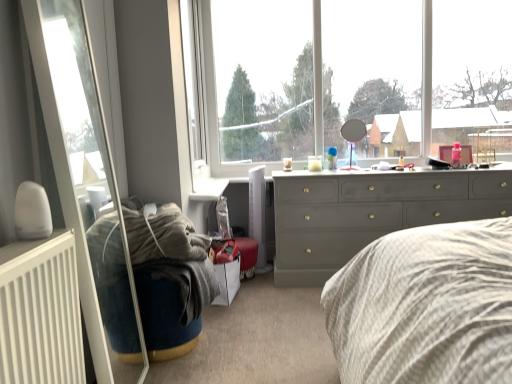
In order to face transparent glass mirror at upper center, should I rotate leftwards or rightwards?

You should look right and rotate roughly 14.026 degrees.

The width and height of the screenshot is (512, 384). What do you see at coordinates (41, 312) in the screenshot?
I see `white matte radiator at lower left` at bounding box center [41, 312].

Where is `transparent glass mirror at upper center`? transparent glass mirror at upper center is located at coordinates (338, 75).

From the image's perspective, is velvet blue bean bag at lower left below transparent glass door at left?

Yes, from the image's perspective, velvet blue bean bag at lower left is beneath transparent glass door at left.

Considering the sizes of objects velvet blue bean bag at lower left and transparent glass door at left in the image provided, who is smaller, velvet blue bean bag at lower left or transparent glass door at left?

velvet blue bean bag at lower left.

Considering the relative positions of velvet blue bean bag at lower left and transparent glass door at left in the image provided, is velvet blue bean bag at lower left in front of transparent glass door at left?

No, the depth of velvet blue bean bag at lower left is greater than that of transparent glass door at left.

Is velvet blue bean bag at lower left turned away from transparent glass door at left?

Yes, velvet blue bean bag at lower left's orientation is away from transparent glass door at left.

Can you confirm if matte gray dresser at center is taller than white matte radiator at lower left?

Indeed, matte gray dresser at center has a greater height compared to white matte radiator at lower left.

Visually, is matte gray dresser at center positioned to the left or to the right of white matte radiator at lower left?

matte gray dresser at center is to the right of white matte radiator at lower left.

Is matte gray dresser at center oriented away from white matte radiator at lower left?

No, matte gray dresser at center is not facing the opposite direction of white matte radiator at lower left.

Choose the correct answer: Is matte gray dresser at center inside white matte radiator at lower left or outside it?

The correct answer is: outside.

Find the location of a particular element. The height and width of the screenshot is (384, 512). chest of drawers above the velvet blue bean bag at lower left (from the image's perspective) is located at coordinates (371, 212).

Is the position of velvet blue bean bag at lower left less distant than that of matte gray dresser at center?

Yes, it is.

Based on the photo, is velvet blue bean bag at lower left placed right next to matte gray dresser at center?

velvet blue bean bag at lower left and matte gray dresser at center are clearly separated.

What's the angular difference between transparent glass door at left and transparent glass mirror at upper center's facing directions?

The angular difference between transparent glass door at left and transparent glass mirror at upper center is 91.1 degrees.

Who is smaller, transparent glass door at left or transparent glass mirror at upper center?

With smaller size is transparent glass door at left.

From the image's perspective, which one is positioned higher, transparent glass door at left or transparent glass mirror at upper center?

transparent glass mirror at upper center, from the image's perspective.

From the picture: How many degrees apart are the facing directions of velvet blue bean bag at lower left and white matte radiator at lower left?

3.26 degrees separate the facing orientations of velvet blue bean bag at lower left and white matte radiator at lower left.

Which object is positioned more to the left, velvet blue bean bag at lower left or white matte radiator at lower left?

white matte radiator at lower left is more to the left.

Is point (200, 284) closer or farther from the camera than point (15, 355)?

Point (200, 284) is positioned farther from the camera compared to point (15, 355).

From a real-world perspective, does velvet blue bean bag at lower left stand above white matte radiator at lower left?

Actually, velvet blue bean bag at lower left is physically below white matte radiator at lower left in the real world.

From a real-world perspective, which is physically above, transparent glass mirror at upper center or matte gray dresser at center?

transparent glass mirror at upper center, from a real-world perspective.

Can matte gray dresser at center be found inside transparent glass mirror at upper center?

No.

Between transparent glass mirror at upper center and matte gray dresser at center, which one has larger size?

matte gray dresser at center.

Between transparent glass mirror at upper center and matte gray dresser at center, which one has less height?

With less height is matte gray dresser at center.

How many degrees apart are the facing directions of white matte radiator at lower left and velvet blue bean bag at lower left?

There is a 3.26-degree angle between the facing directions of white matte radiator at lower left and velvet blue bean bag at lower left.

In terms of size, does white matte radiator at lower left appear bigger or smaller than velvet blue bean bag at lower left?

white matte radiator at lower left is smaller than velvet blue bean bag at lower left.

Looking at this image, is white matte radiator at lower left not near velvet blue bean bag at lower left?

white matte radiator at lower left is actually quite close to velvet blue bean bag at lower left.

From the image's perspective, relative to velvet blue bean bag at lower left, is white matte radiator at lower left above or below?

From the image's perspective, white matte radiator at lower left appears above velvet blue bean bag at lower left.

This screenshot has width=512, height=384. Identify the location of bean bag chair on the right of transparent glass door at left. (169, 278).

Image resolution: width=512 pixels, height=384 pixels. In order to click on radiator on the left of the matte gray dresser at center in this screenshot , I will do `click(41, 312)`.

When comparing their distances from transparent glass mirror at upper center, does white matte radiator at lower left or velvet blue bean bag at lower left seem further?

Among the two, white matte radiator at lower left is located further to transparent glass mirror at upper center.

Which object lies further to the anchor point velvet blue bean bag at lower left, transparent glass door at left or matte gray dresser at center?

Based on the image, matte gray dresser at center appears to be further to velvet blue bean bag at lower left.

When comparing their distances from matte gray dresser at center, does white matte radiator at lower left or transparent glass mirror at upper center seem closer?

transparent glass mirror at upper center is closer to matte gray dresser at center.

When comparing their distances from white matte radiator at lower left, does matte gray dresser at center or velvet blue bean bag at lower left seem closer?

velvet blue bean bag at lower left lies closer to white matte radiator at lower left than the other object.

Based on the photo, from the image, which object appears to be nearer to matte gray dresser at center, transparent glass door at left or transparent glass mirror at upper center?

The object closer to matte gray dresser at center is transparent glass mirror at upper center.

Estimate the real-world distances between objects in this image. Which object is closer to white matte radiator at lower left, matte gray dresser at center or transparent glass door at left?

Based on the image, transparent glass door at left appears to be nearer to white matte radiator at lower left.

Estimate the real-world distances between objects in this image. Which object is closer to transparent glass mirror at upper center, velvet blue bean bag at lower left or white matte radiator at lower left?

velvet blue bean bag at lower left is positioned closer to the anchor transparent glass mirror at upper center.

When comparing their distances from transparent glass mirror at upper center, does velvet blue bean bag at lower left or transparent glass door at left seem further?

The object further to transparent glass mirror at upper center is transparent glass door at left.

Locate an element on the screen. This screenshot has height=384, width=512. bean bag chair between transparent glass door at left and matte gray dresser at center from left to right is located at coordinates (169, 278).

This screenshot has width=512, height=384. Identify the location of bean bag chair between transparent glass door at left and transparent glass mirror at upper center from front to back. (169, 278).

Identify the location of bean bag chair between white matte radiator at lower left and matte gray dresser at center from front to back. The height and width of the screenshot is (384, 512). (169, 278).

Identify the location of window situated between velvet blue bean bag at lower left and matte gray dresser at center from left to right. Image resolution: width=512 pixels, height=384 pixels. (338, 75).